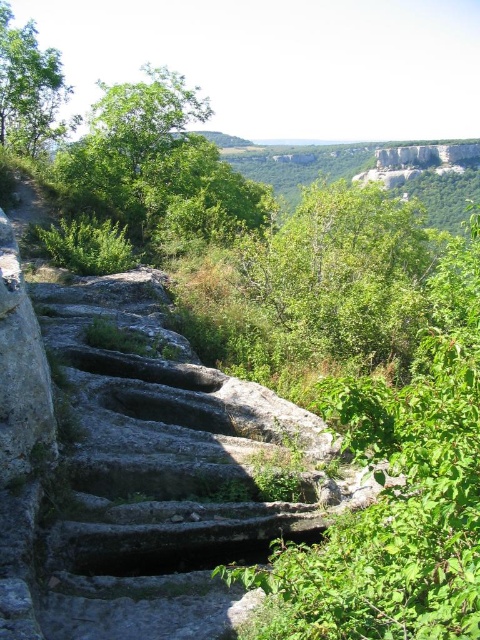
You are a hiker standing at the top of the stone steps and want to take a photo of both the green leafy tree at upper center and the green leafy tree at upper left. Which tree should you focus on first if you want to include both in your frame without moving the camera?

You should focus on the green leafy tree at upper center first because it is wider than the green leafy tree at upper left, so capturing its full width will ensure both trees fit in the frame.

You are a hiker who wants to take a photo of both the green leafy tree at center and the green leafy tree at upper center. Which tree should you stand closer to in order to capture both in a single frame?

You should stand closer to the green leafy tree at center because it is thinner than the green leafy tree at upper center, allowing you to fit both into the frame by positioning yourself nearer to the smaller tree.